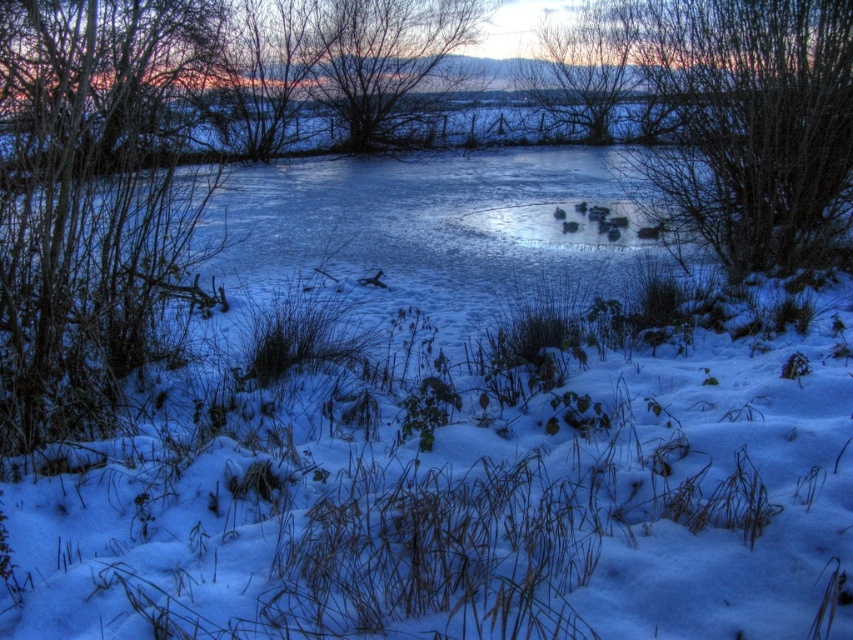
How distant is smooth bark tree at left from bare branches at upper center?

smooth bark tree at left is 16.96 feet from bare branches at upper center.

Does smooth bark tree at left come behind bare branches at upper center?

No, it is in front of bare branches at upper center.

Is point (141, 262) positioned behind point (463, 42)?

No, it is in front of (463, 42).

This screenshot has width=853, height=640. In order to click on smooth bark tree at left in this screenshot , I will do `click(93, 198)`.

Is point (111, 358) positioned after point (670, 51)?

No, (111, 358) is in front of (670, 51).

Is smooth bark tree at left further to camera compared to bare branches at upper right?

No, it is in front of bare branches at upper right.

Is point (38, 1) closer to camera compared to point (827, 177)?

No, (38, 1) is further to viewer.

Locate an element on the screen. Image resolution: width=853 pixels, height=640 pixels. smooth bark tree at left is located at coordinates (93, 198).

Between bare branches at upper right and bare branches at upper center, which one is positioned lower?

bare branches at upper right

Can you confirm if bare branches at upper right is taller than bare branches at upper center?

Yes.

At what (x,y) coordinates should I click in order to perform the action: click on bare branches at upper right. Please return your answer as a coordinate pair (x, y). Looking at the image, I should click on (746, 125).